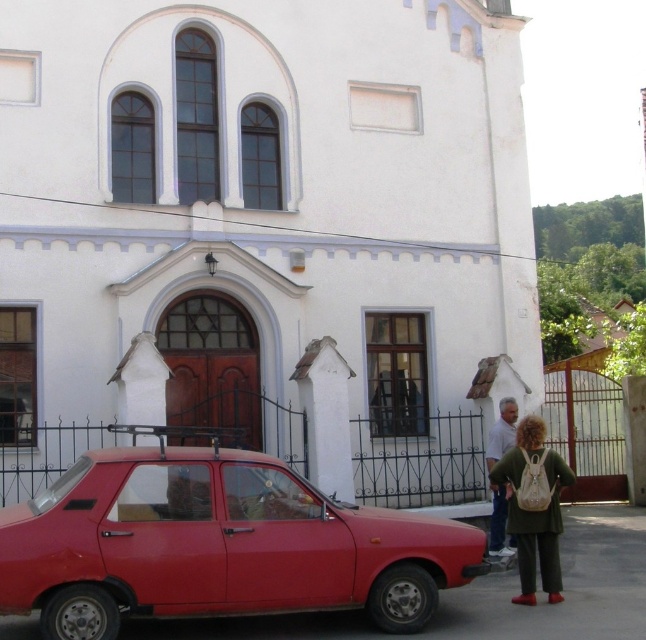
Question: Estimate the real-world distances between objects in this image. Which object is closer to the green fabric jacket at lower right?

Choices:
 (A) green fabric backpack at lower right
 (B) white smooth church at center

Answer: (A)

Question: Which point is farther to the camera?

Choices:
 (A) click(x=3, y=291)
 (B) click(x=523, y=509)
 (C) click(x=497, y=532)

Answer: (A)

Question: Which object is closer to the camera taking this photo?

Choices:
 (A) glossy red car at lower left
 (B) green fabric jacket at lower right

Answer: (A)

Question: Is white smooth church at center thinner than green fabric backpack at lower right?

Choices:
 (A) no
 (B) yes

Answer: (A)

Question: Does green fabric backpack at lower right appear on the right side of green fabric jacket at lower right?

Choices:
 (A) no
 (B) yes

Answer: (A)

Question: Is green fabric backpack at lower right further to camera compared to green fabric jacket at lower right?

Choices:
 (A) yes
 (B) no

Answer: (B)